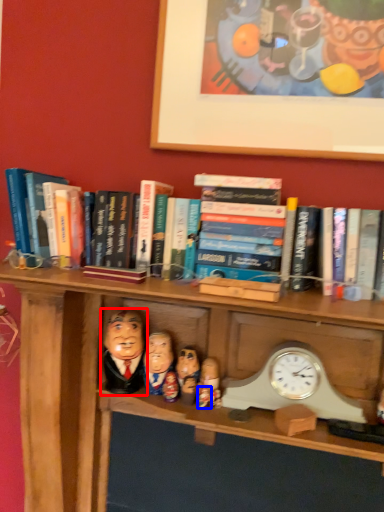
Question: Which object appears closest to the camera in this image, person (highlighted by a red box) or toy (highlighted by a blue box)?

Choices:
 (A) person
 (B) toy

Answer: (B)